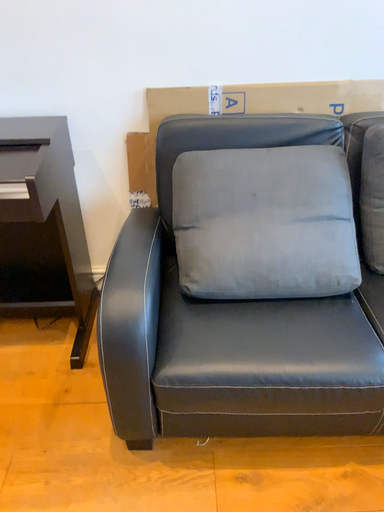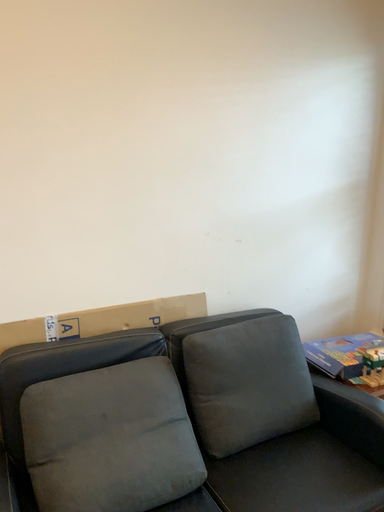
Question: Which way did the camera rotate in the video?

Choices:
 (A) rotated upward
 (B) rotated downward

Answer: (A)